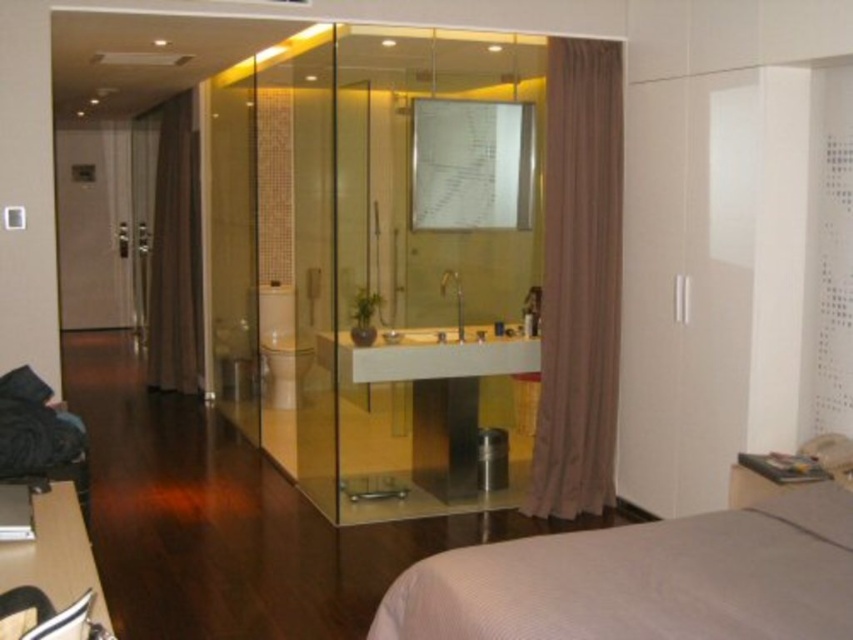
Question: Is brown sheer curtain at right further to the viewer compared to brown fabric curtain at left?

Choices:
 (A) no
 (B) yes

Answer: (A)

Question: Which of the following is the farthest from the observer?

Choices:
 (A) (172, 214)
 (B) (351, 454)
 (C) (77, 152)
 (D) (585, 67)

Answer: (C)

Question: Which object appears farthest from the camera in this image?

Choices:
 (A) brown sheer curtain at right
 (B) transparent glass shower at center
 (C) matte brown door at left
 (D) brown fabric curtain at left

Answer: (C)

Question: Which object appears farthest from the camera in this image?

Choices:
 (A) gray fabric bed at lower right
 (B) matte brown door at left

Answer: (B)

Question: Does transparent glass shower at center have a smaller size compared to gray fabric bed at lower right?

Choices:
 (A) no
 (B) yes

Answer: (A)

Question: In this image, where is transparent glass shower at center located relative to brown fabric curtain at left?

Choices:
 (A) right
 (B) left

Answer: (A)